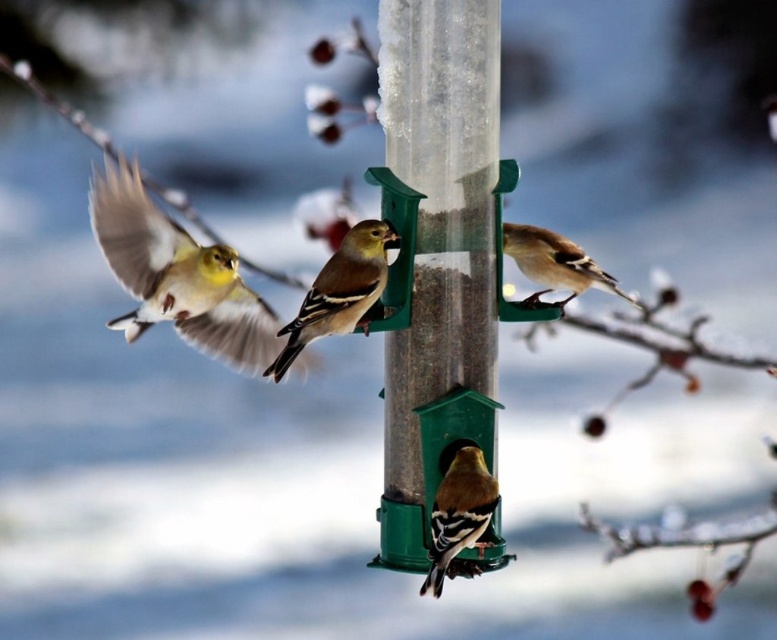
Is point (127, 220) positioned in front of point (507, 240)?

Yes, point (127, 220) is closer to viewer.

Which is above, matte yellow bird at left or golden yellow feathers at center?

golden yellow feathers at center

Who is more forward, (269, 337) or (521, 260)?

Positioned in front is point (521, 260).

At what (x,y) coordinates should I click in order to perform the action: click on matte yellow bird at left. Please return your answer as a coordinate pair (x, y). Looking at the image, I should click on (176, 275).

Can you confirm if transparent plastic pole at center is positioned below matte yellow bird at left?

Correct, transparent plastic pole at center is located below matte yellow bird at left.

Locate an element on the screen. transparent plastic pole at center is located at coordinates (437, 252).

Does transparent plastic pole at center appear over yellow and black feathers at center?

Correct, transparent plastic pole at center is located above yellow and black feathers at center.

Can you confirm if transparent plastic pole at center is positioned below yellow and black feathers at center?

No.

The height and width of the screenshot is (640, 777). In order to click on transparent plastic pole at center in this screenshot , I will do `click(437, 252)`.